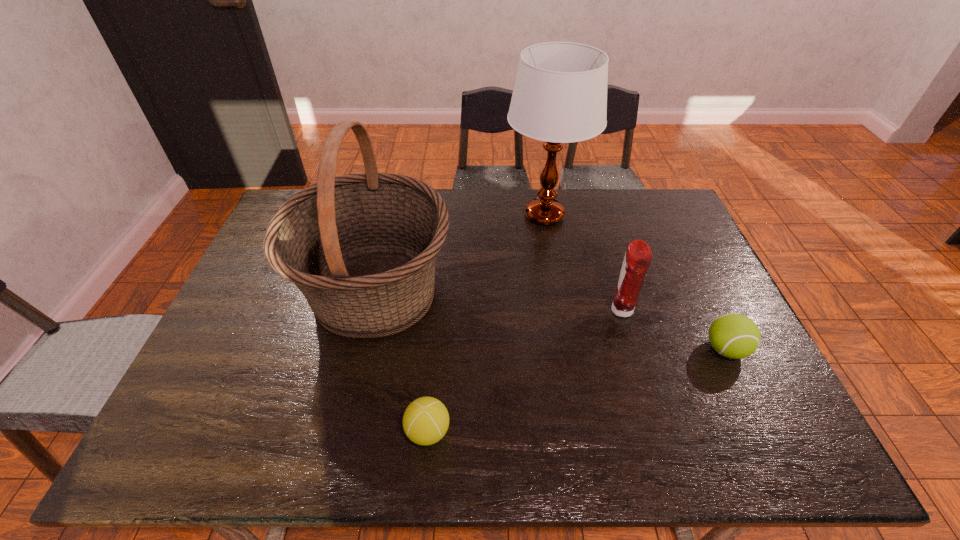
At what (x,y) coordinates should I click in order to perform the action: click on vacant region at the far right corner of the desktop. Please return your answer as a coordinate pair (x, y). The width and height of the screenshot is (960, 540). Looking at the image, I should click on (661, 192).

Identify the location of free region at the near right corner of the desktop. The height and width of the screenshot is (540, 960). (731, 424).

This screenshot has height=540, width=960. I want to click on vacant point located between the nearer tennis ball and the basket, so click(x=402, y=362).

Locate an element on the screen. vacant region between the basket and the table lamp is located at coordinates (460, 253).

This screenshot has height=540, width=960. Identify the location of free spot between the basket and the right tennis ball. (551, 321).

Where is `free spot between the table lamp and the basket`? This screenshot has width=960, height=540. free spot between the table lamp and the basket is located at coordinates (460, 253).

Locate an element on the screen. The height and width of the screenshot is (540, 960). vacant area that lies between the basket and the farther tennis ball is located at coordinates (551, 321).

Where is `vacant region between the basket and the farther tennis ball`? The width and height of the screenshot is (960, 540). vacant region between the basket and the farther tennis ball is located at coordinates (551, 321).

Locate an element on the screen. This screenshot has height=540, width=960. vacant space in between the rightmost object and the third shortest object is located at coordinates (673, 329).

The width and height of the screenshot is (960, 540). I want to click on free space between the third tallest object and the farther tennis ball, so click(673, 329).